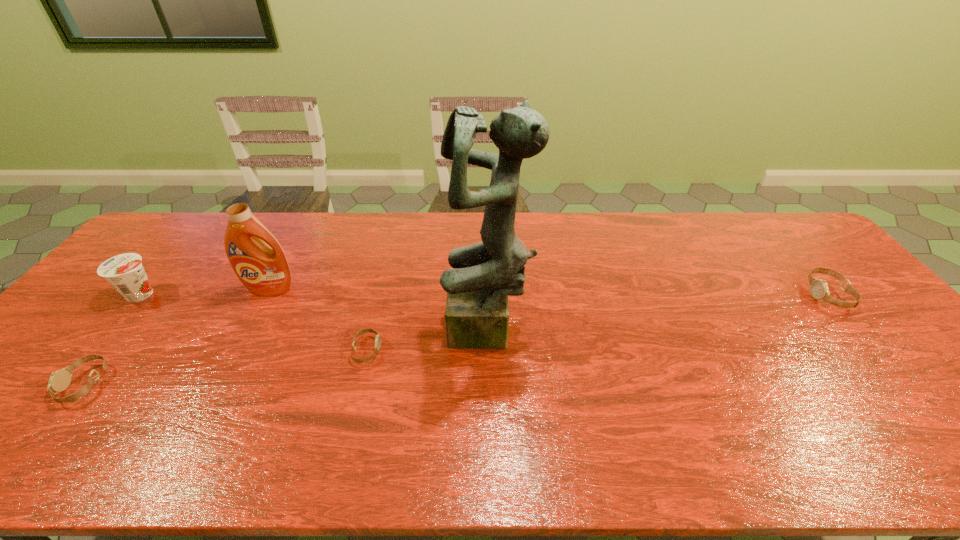
Please point a location where one more watch can be added evenly. Please provide its 2D coordinates. Your answer should be formatted as a tuple, i.e. [(x, y)], where the tuple contains the x and y coordinates of a point satisfying the conditions above.

[(612, 321)]